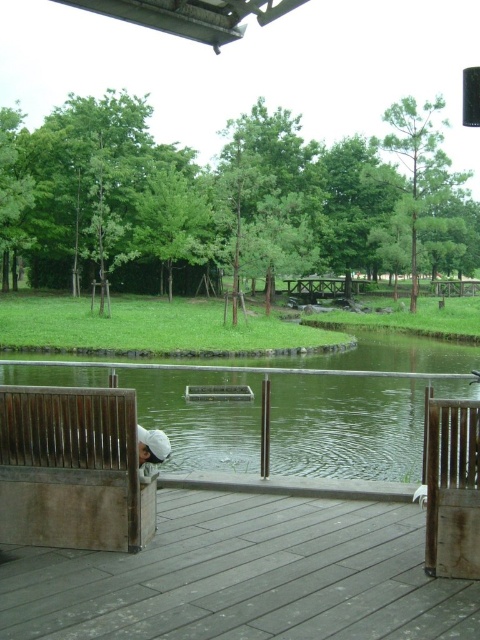
Is wooden deck at lower center shorter than brown wooden bench at lower left?

Correct, wooden deck at lower center is not as tall as brown wooden bench at lower left.

From the picture: Who is positioned more to the left, wooden deck at lower center or brown wooden bench at lower left?

From the viewer's perspective, brown wooden bench at lower left appears more on the left side.

This screenshot has height=640, width=480. What do you see at coordinates (244, 577) in the screenshot?
I see `wooden deck at lower center` at bounding box center [244, 577].

Where is `wooden deck at lower center`? wooden deck at lower center is located at coordinates (244, 577).

Between wooden deck at lower center and brown wooden bench at right, which one appears on the right side from the viewer's perspective?

brown wooden bench at right

Does wooden deck at lower center have a greater width compared to brown wooden bench at right?

Yes, wooden deck at lower center is wider than brown wooden bench at right.

Does point (444, 634) come farther from viewer compared to point (459, 524)?

No, (444, 634) is in front of (459, 524).

At what (x,y) coordinates should I click in order to perform the action: click on wooden deck at lower center. Please return your answer as a coordinate pair (x, y). Looking at the image, I should click on (244, 577).

Can you confirm if brown wooden bench at lower left is taller than brown wooden bench at right?

In fact, brown wooden bench at lower left may be shorter than brown wooden bench at right.

Can you confirm if brown wooden bench at lower left is positioned below brown wooden bench at right?

No.

Who is more forward, (98, 524) or (429, 477)?

Point (429, 477) is more forward.

Where is `brown wooden bench at lower left`? brown wooden bench at lower left is located at coordinates (72, 468).